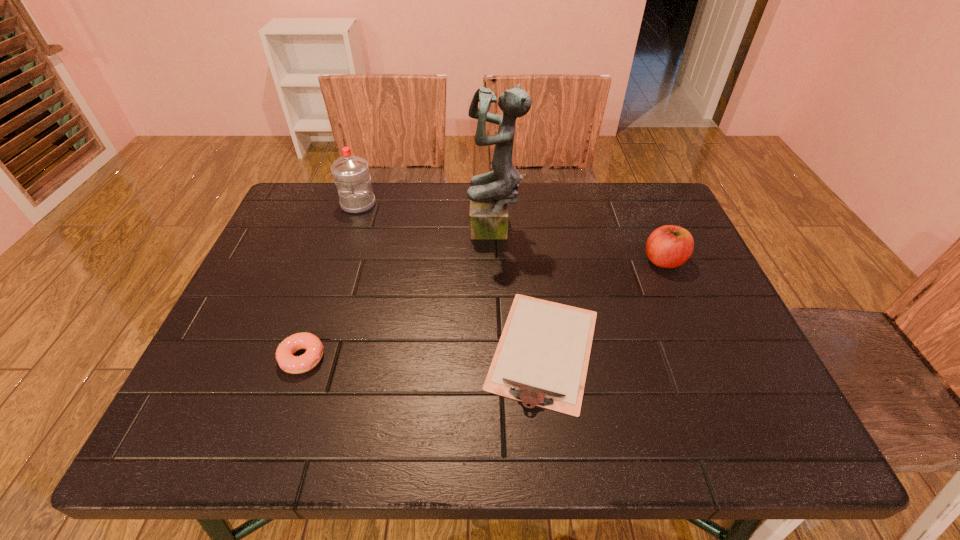
Find the location of `free location located on the handle side of the farthest object`. free location located on the handle side of the farthest object is located at coordinates (334, 278).

Image resolution: width=960 pixels, height=540 pixels. Find the location of `vacant space located on the back of the rightmost object`. vacant space located on the back of the rightmost object is located at coordinates (642, 212).

Image resolution: width=960 pixels, height=540 pixels. I want to click on free space located 0.170m on the right of the second shortest object, so click(405, 358).

I want to click on free space located 0.400m on the back of the clipboard, so click(x=525, y=198).

Image resolution: width=960 pixels, height=540 pixels. What are the coordinates of `sculpture present at the far edge` in the screenshot? It's located at (490, 193).

This screenshot has width=960, height=540. Identify the location of water bottle at the far edge. (351, 174).

The image size is (960, 540). What are the coordinates of `object present at the near edge` in the screenshot? It's located at (542, 357).

Locate an element on the screen. The image size is (960, 540). water bottle at the left edge is located at coordinates (351, 174).

This screenshot has width=960, height=540. In order to click on doughnut that is at the left edge in this screenshot , I will do `click(289, 363)`.

This screenshot has width=960, height=540. What are the coordinates of `object located at the right edge` in the screenshot? It's located at (669, 246).